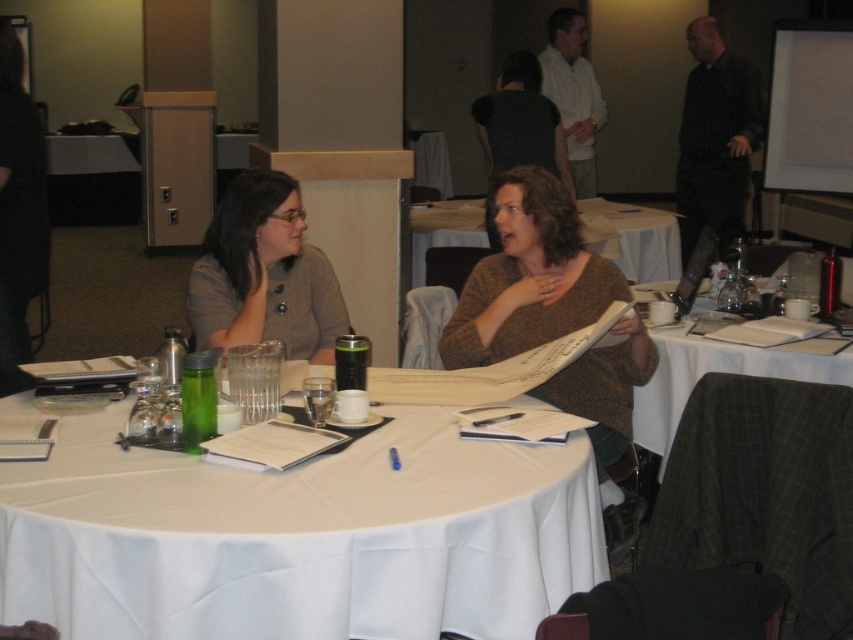
Question: Does white fabric tablecloth at center come in front of brown fuzzy sweater at center?

Choices:
 (A) no
 (B) yes

Answer: (B)

Question: Does brown fuzzy sweater at center have a greater width compared to matte gray sweater at center?

Choices:
 (A) yes
 (B) no

Answer: (A)

Question: Which object appears farthest from the camera in this image?

Choices:
 (A) white paper at center
 (B) brown fuzzy sweater at center
 (C) matte gray sweater at center
 (D) white fabric table at lower right

Answer: (A)

Question: Which object appears closest to the camera in this image?

Choices:
 (A) matte gray sweater at center
 (B) white fabric tablecloth at center
 (C) white fabric table at lower right
 (D) white paper at center

Answer: (B)

Question: Can you confirm if brown fuzzy sweater at center is bigger than matte gray sweater at center?

Choices:
 (A) yes
 (B) no

Answer: (A)

Question: Which of the following is the closest to the observer?

Choices:
 (A) white paper at center
 (B) matte gray sweater at center
 (C) white fabric table at lower right
 (D) brown fuzzy sweater at center

Answer: (B)